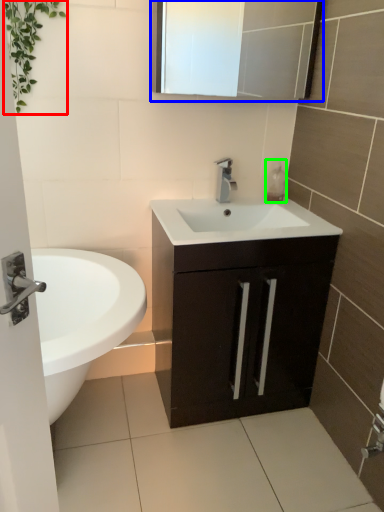
Question: Considering the real-world distances, which object is farthest from vegetation (highlighted by a red box)? medicine cabinet (highlighted by a blue box) or soap dispenser (highlighted by a green box)?

Choices:
 (A) medicine cabinet
 (B) soap dispenser

Answer: (B)